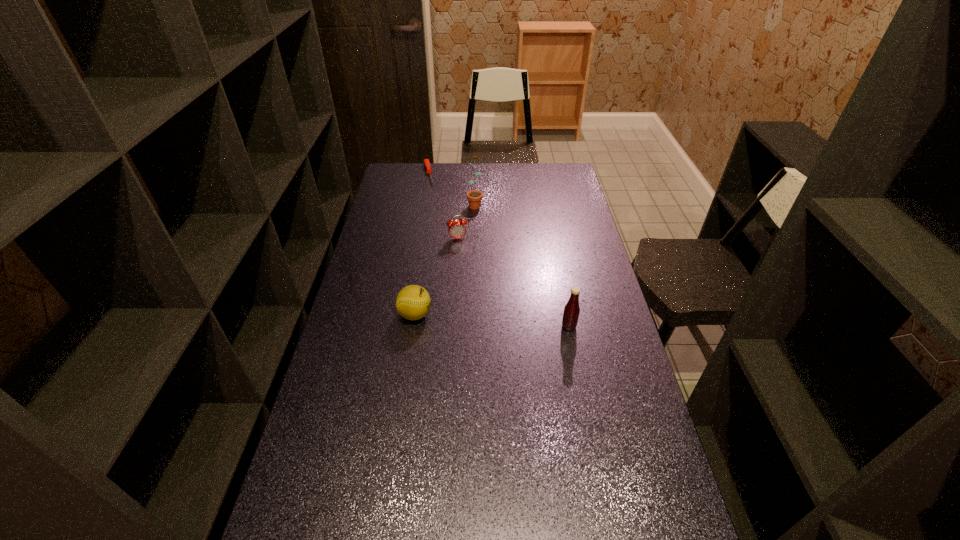
Identify the location of free space located 0.400m on the flower of the sunflower. (472, 271).

Identify the location of vacant space located 0.330m on the flower of the sunflower. (473, 259).

Locate an element on the screen. vacant point located on the flower of the sunflower is located at coordinates 473,255.

Where is `free spot located 0.070m on the face of the alarm clock`? The width and height of the screenshot is (960, 540). free spot located 0.070m on the face of the alarm clock is located at coordinates (462, 253).

At what (x,y) coordinates should I click in order to perform the action: click on free space located on the face of the alarm clock. Please return your answer as a coordinate pair (x, y). The height and width of the screenshot is (540, 960). Looking at the image, I should click on (476, 307).

The height and width of the screenshot is (540, 960). In order to click on free space located 0.200m on the face of the alarm clock in this screenshot , I will do `click(468, 275)`.

Locate an element on the screen. vacant area situated at the tip of the shortest object is located at coordinates (437, 215).

Identify the location of vacant area situated at the tip of the shortest object. This screenshot has width=960, height=540. (440, 227).

At what (x,y) coordinates should I click in order to perform the action: click on vacant region located at the tip of the shortest object. Please return your answer as a coordinate pair (x, y). The height and width of the screenshot is (540, 960). Looking at the image, I should click on (440, 227).

I want to click on object present at the far edge, so click(x=426, y=161).